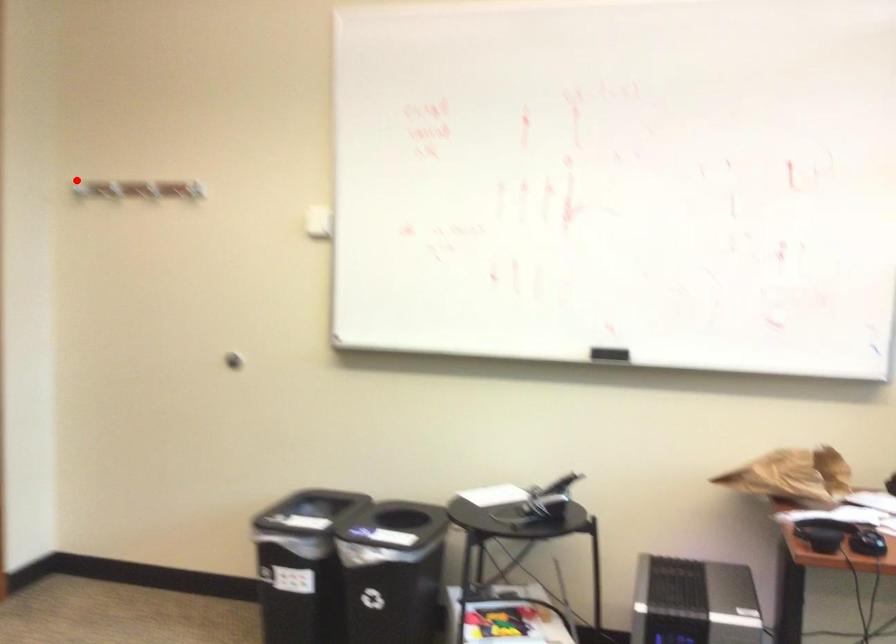
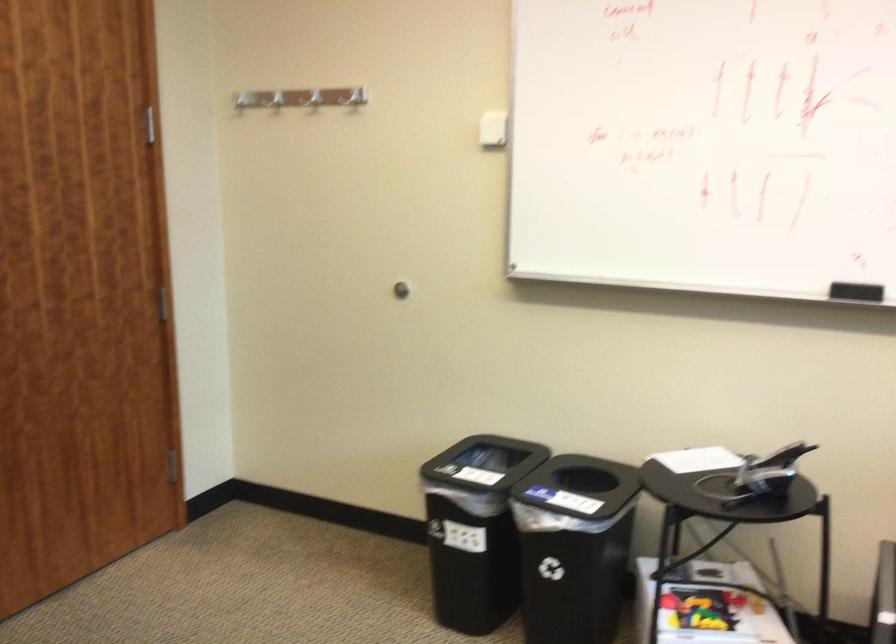
In the second image, find the point that corresponds to the highlighted location in the first image.

(240, 100)